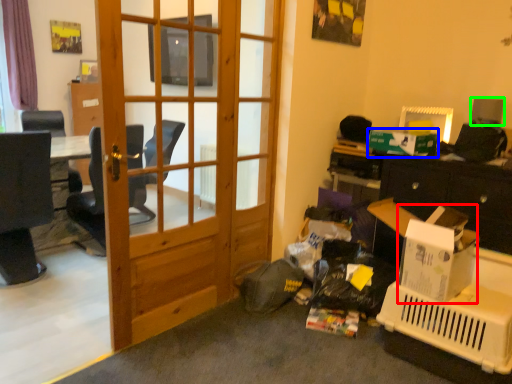
Question: Which object is the farthest from cardboard box (highlighted by a red box)? Choose among these: box (highlighted by a blue box) or loudspeaker (highlighted by a green box).

Choices:
 (A) box
 (B) loudspeaker

Answer: (B)